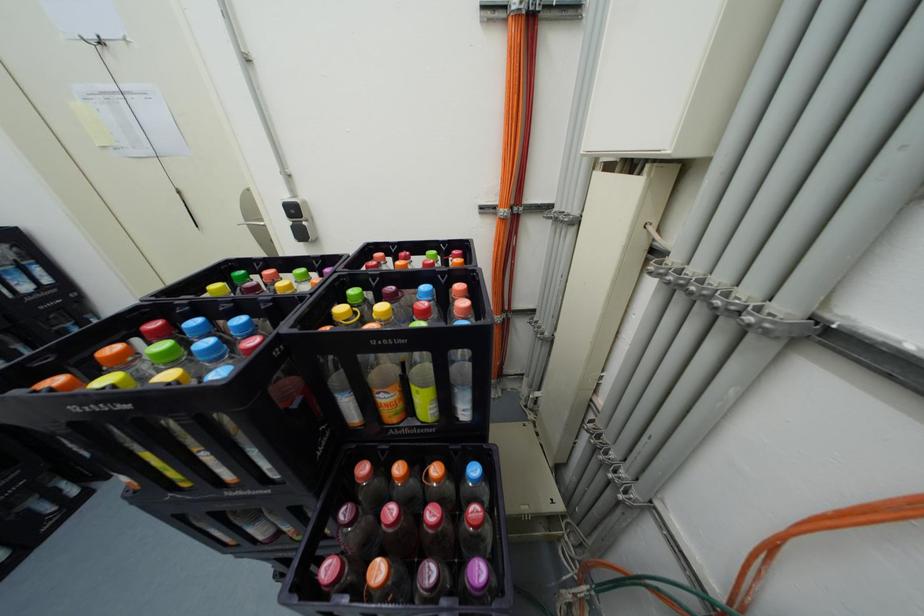
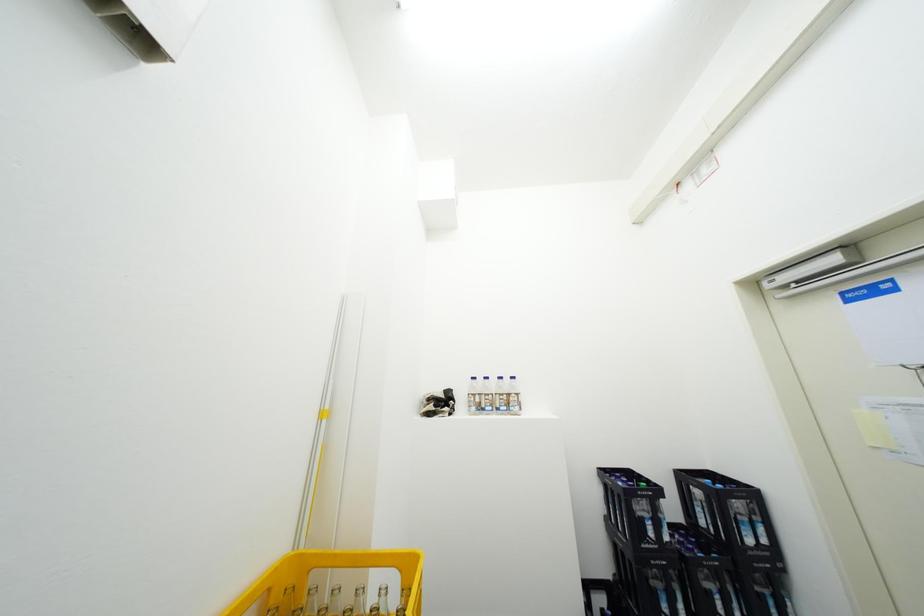
Question: The camera is either moving clockwise (left) or counter-clockwise (right) around the object. The first image is from the beginning of the video and the second image is from the end. Is the camera moving left or right when shooting the video?

Choices:
 (A) Left
 (B) Right

Answer: (B)